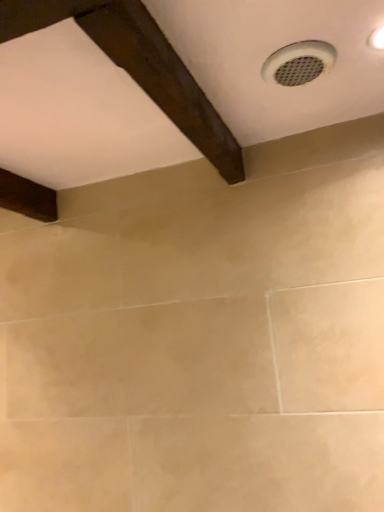
In order to face dark brown wood at upper left, should I rotate leftwards or rightwards?

Rotate your view left by about 0.407°.

What do you see at coordinates (138, 66) in the screenshot? I see `dark brown wood at upper left` at bounding box center [138, 66].

Measure the distance between point (190, 140) and camera.

The depth of point (190, 140) is 36.61 inches.

Where is `dark brown wood at upper left`? dark brown wood at upper left is located at coordinates 138,66.

What do you see at coordinates (298, 63) in the screenshot? This screenshot has height=512, width=384. I see `white plastic vent at upper right` at bounding box center [298, 63].

Locate an element on the screen. white plastic vent at upper right is located at coordinates (298, 63).

Locate an element on the screen. The width and height of the screenshot is (384, 512). dark brown wood at upper left is located at coordinates (138, 66).

Is white plastic vent at upper right at the left side of dark brown wood at upper left?

Incorrect, white plastic vent at upper right is not on the left side of dark brown wood at upper left.

Which is in front, white plastic vent at upper right or dark brown wood at upper left?

dark brown wood at upper left is closer to the camera.

Between point (307, 73) and point (124, 5), which one is positioned in front?

Point (124, 5)

From the image's perspective, which object appears higher, white plastic vent at upper right or dark brown wood at upper left?

white plastic vent at upper right.

From a real-world perspective, which object rests below the other?

In real-world perspective, dark brown wood at upper left is lower.

Considering the sizes of objects white plastic vent at upper right and dark brown wood at upper left in the image provided, who is wider, white plastic vent at upper right or dark brown wood at upper left?

Wider between the two is dark brown wood at upper left.

Does white plastic vent at upper right have a greater height compared to dark brown wood at upper left?

In fact, white plastic vent at upper right may be shorter than dark brown wood at upper left.

Based on their sizes in the image, would you say white plastic vent at upper right is bigger or smaller than dark brown wood at upper left?

Clearly, white plastic vent at upper right is smaller in size than dark brown wood at upper left.

Would you say white plastic vent at upper right is inside or outside dark brown wood at upper left?

white plastic vent at upper right exists outside the volume of dark brown wood at upper left.

Is white plastic vent at upper right not close to dark brown wood at upper left?

No, white plastic vent at upper right is not far from dark brown wood at upper left.

Is white plastic vent at upper right positioned with its back to dark brown wood at upper left?

No, white plastic vent at upper right is not facing away from dark brown wood at upper left.

Based on the photo, can you tell me how much white plastic vent at upper right and dark brown wood at upper left differ in facing direction?

There is a 0.612-degree angle between the facing directions of white plastic vent at upper right and dark brown wood at upper left.

Locate an element on the screen. This screenshot has height=512, width=384. exhaust hood that appears below the white plastic vent at upper right (from a real-world perspective) is located at coordinates (138, 66).

Consider the image. Is dark brown wood at upper left at the right side of white plastic vent at upper right?

No.

In the image, is dark brown wood at upper left positioned in front of or behind white plastic vent at upper right?

dark brown wood at upper left is positioned closer to the viewer than white plastic vent at upper right.

Considering the positions of point (173, 98) and point (311, 59), is point (173, 98) closer or farther from the camera than point (311, 59)?

Point (173, 98) appears to be closer to the viewer than point (311, 59).

Based on the photo, from the image's perspective, relative to white plastic vent at upper right, is dark brown wood at upper left above or below?

dark brown wood at upper left is below white plastic vent at upper right.

In the scene shown: From a real-world perspective, which is physically above, dark brown wood at upper left or white plastic vent at upper right?

From a 3D spatial view, white plastic vent at upper right is above.

Which object is wider, dark brown wood at upper left or white plastic vent at upper right?

Wider between the two is dark brown wood at upper left.

Is dark brown wood at upper left shorter than white plastic vent at upper right?

No, dark brown wood at upper left is not shorter than white plastic vent at upper right.

Considering the sizes of objects dark brown wood at upper left and white plastic vent at upper right in the image provided, who is bigger, dark brown wood at upper left or white plastic vent at upper right?

dark brown wood at upper left.

Can we say dark brown wood at upper left lies outside white plastic vent at upper right?

Yes, dark brown wood at upper left is located beyond the bounds of white plastic vent at upper right.

Consider the image. Is dark brown wood at upper left touching white plastic vent at upper right?

They are not placed beside each other.

In the scene shown: Is dark brown wood at upper left oriented away from white plastic vent at upper right?

No, dark brown wood at upper left is not facing away from white plastic vent at upper right.

Locate an element on the screen. The image size is (384, 512). plumbing fixture lying behind the dark brown wood at upper left is located at coordinates (298, 63).

Identify the location of exhaust hood beneath the white plastic vent at upper right (from a real-world perspective). The height and width of the screenshot is (512, 384). (138, 66).

The width and height of the screenshot is (384, 512). In the image, there is a white plastic vent at upper right. What are the coordinates of `exhaust hood below it (from the image's perspective)` in the screenshot? It's located at (138, 66).